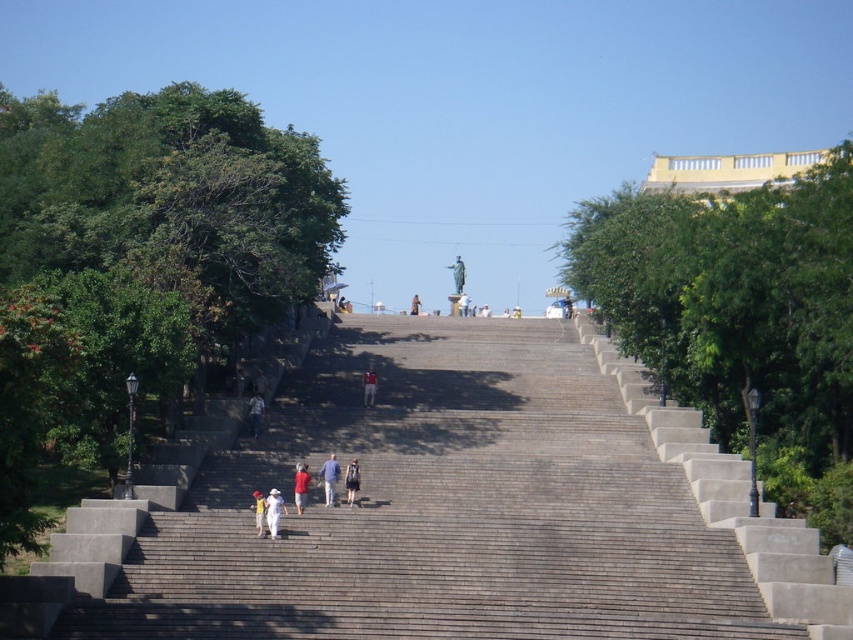
How far apart are gray concrete stairs at center and red matte shirt at center?

They are 24.21 meters apart.

Which is below, gray concrete stairs at center or red matte shirt at center?

Positioned lower is red matte shirt at center.

Locate an element on the screen. gray concrete stairs at center is located at coordinates (453, 513).

The width and height of the screenshot is (853, 640). I want to click on gray concrete stairs at center, so click(x=453, y=513).

Can you confirm if white cotton shirt at center is bigger than red shirt at center?

Correct, white cotton shirt at center is larger in size than red shirt at center.

Who is more forward, (258, 413) or (370, 365)?

Point (258, 413)

Who is more forward, [247,408] or [369,401]?

Positioned in front is point [247,408].

Image resolution: width=853 pixels, height=640 pixels. I want to click on white cotton shirt at center, so click(254, 413).

Can you confirm if white matte hat at center is positioned to the left of bronze statue at upper center?

Yes, white matte hat at center is to the left of bronze statue at upper center.

Is white matte hat at center above bronze statue at upper center?

Actually, white matte hat at center is below bronze statue at upper center.

Locate an element on the screen. The width and height of the screenshot is (853, 640). white matte hat at center is located at coordinates (258, 513).

Locate an element on the screen. This screenshot has height=640, width=853. white matte hat at center is located at coordinates (258, 513).